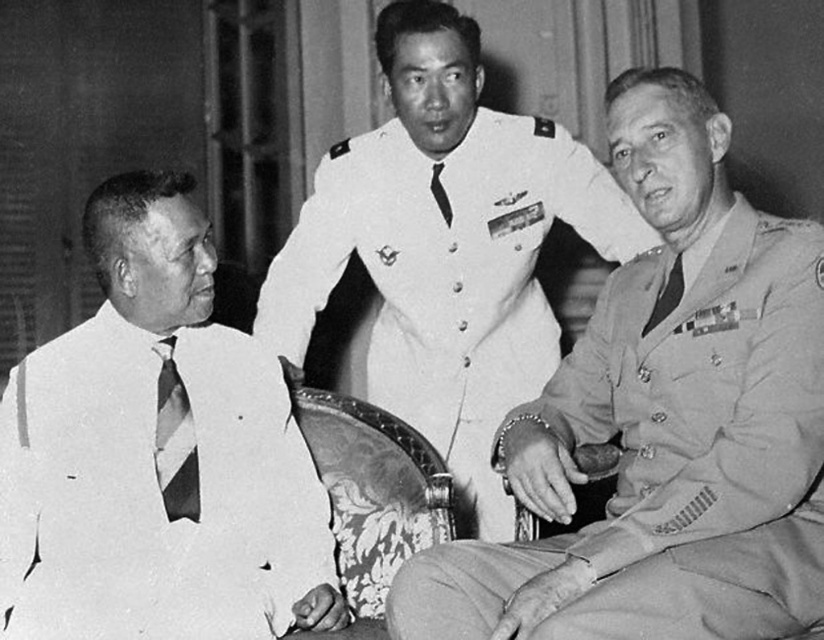
Question: Which point appears closest to the camera in this image?

Choices:
 (A) (515, 371)
 (B) (439, 205)
 (C) (666, 632)

Answer: (C)

Question: Which of the following is the farthest from the observer?

Choices:
 (A) (659, 292)
 (B) (431, 342)
 (C) (186, 403)
 (D) (583, 422)

Answer: (B)

Question: Can you confirm if white striped tie at left is bigger than white cloth uniform at center?

Choices:
 (A) no
 (B) yes

Answer: (A)

Question: Where is white striped tie at left located in relation to matte striped tie at right in the image?

Choices:
 (A) left
 (B) right

Answer: (A)

Question: Is white striped tie at left positioned before striped fabric tie at left?

Choices:
 (A) no
 (B) yes

Answer: (B)

Question: Which is farther from the satin military uniform at right?

Choices:
 (A) black silk tie at center
 (B) matte striped tie at right
 (C) white striped tie at left

Answer: (A)